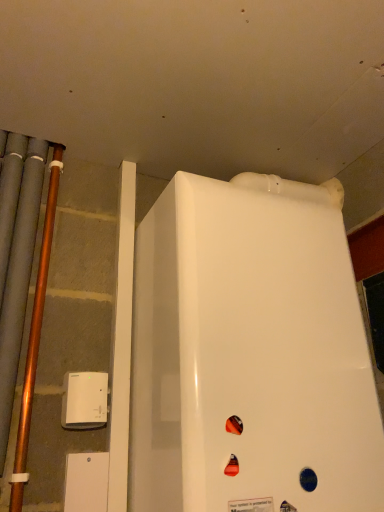
Question: From a real-world perspective, is white plastic device at lower left on top of white glossy refrigerator at center?

Choices:
 (A) no
 (B) yes

Answer: (A)

Question: Can you confirm if white plastic device at lower left is smaller than white glossy refrigerator at center?

Choices:
 (A) yes
 (B) no

Answer: (A)

Question: Considering the relative positions of white plastic device at lower left and white glossy refrigerator at center in the image provided, is white plastic device at lower left to the right of white glossy refrigerator at center from the viewer's perspective?

Choices:
 (A) no
 (B) yes

Answer: (A)

Question: Is the depth of white plastic device at lower left greater than that of white glossy refrigerator at center?

Choices:
 (A) no
 (B) yes

Answer: (B)

Question: Can you confirm if white plastic device at lower left is thinner than white glossy refrigerator at center?

Choices:
 (A) no
 (B) yes

Answer: (B)

Question: Considering the relative sizes of white plastic device at lower left and white glossy refrigerator at center in the image provided, is white plastic device at lower left shorter than white glossy refrigerator at center?

Choices:
 (A) yes
 (B) no

Answer: (A)

Question: From a real-world perspective, is copper metallic pipe at left on top of white glossy refrigerator at center?

Choices:
 (A) yes
 (B) no

Answer: (A)

Question: Is the surface of copper metallic pipe at left in direct contact with white glossy refrigerator at center?

Choices:
 (A) no
 (B) yes

Answer: (A)

Question: Is copper metallic pipe at left positioned behind white glossy refrigerator at center?

Choices:
 (A) no
 (B) yes

Answer: (B)

Question: Is copper metallic pipe at left bigger than white glossy refrigerator at center?

Choices:
 (A) no
 (B) yes

Answer: (A)

Question: Is copper metallic pipe at left at the left side of white glossy refrigerator at center?

Choices:
 (A) yes
 (B) no

Answer: (A)

Question: Is copper metallic pipe at left facing towards white glossy refrigerator at center?

Choices:
 (A) no
 (B) yes

Answer: (A)

Question: Could you tell me if white glossy refrigerator at center is facing white plastic device at lower left?

Choices:
 (A) yes
 (B) no

Answer: (B)